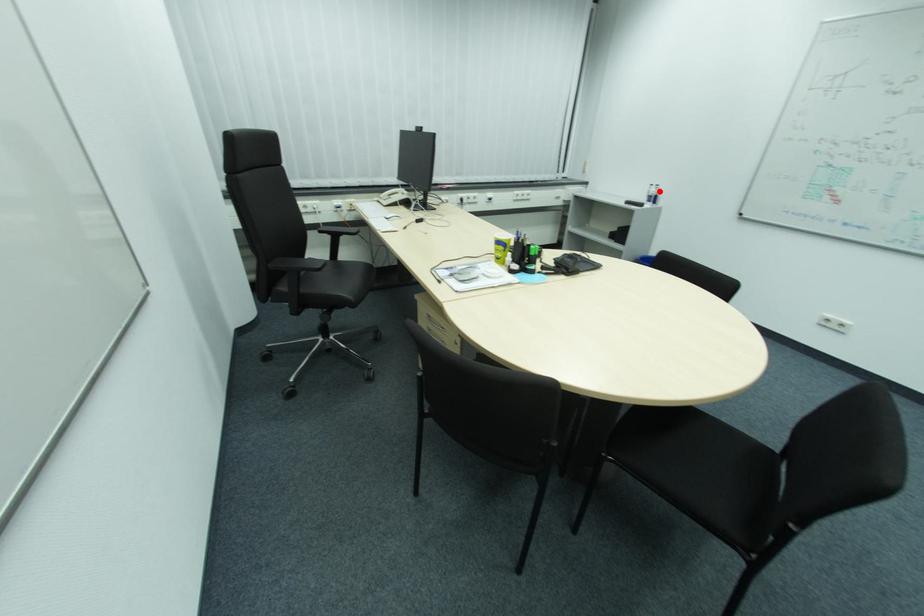
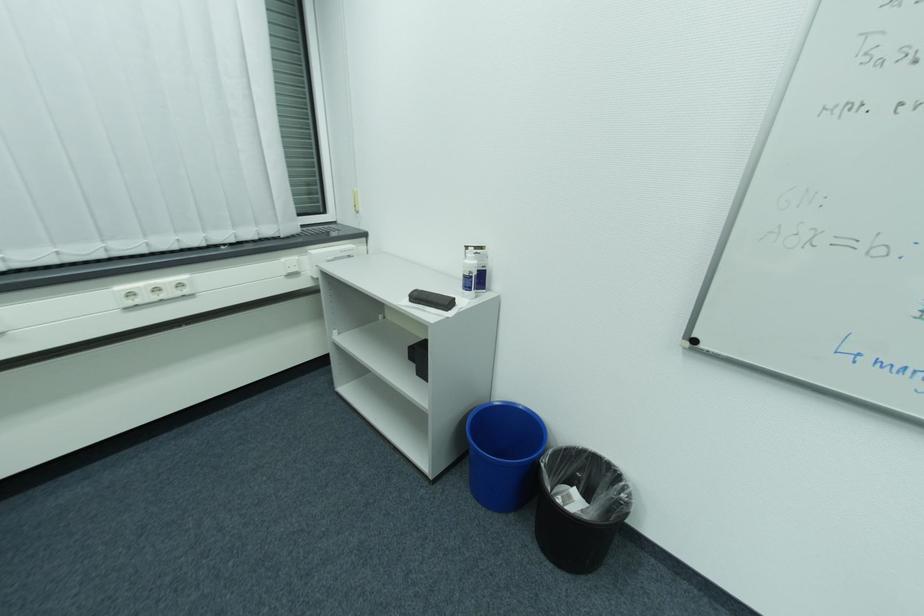
Locate, in the second image, the point that corresponds to the highlighted location in the first image.

(478, 264)